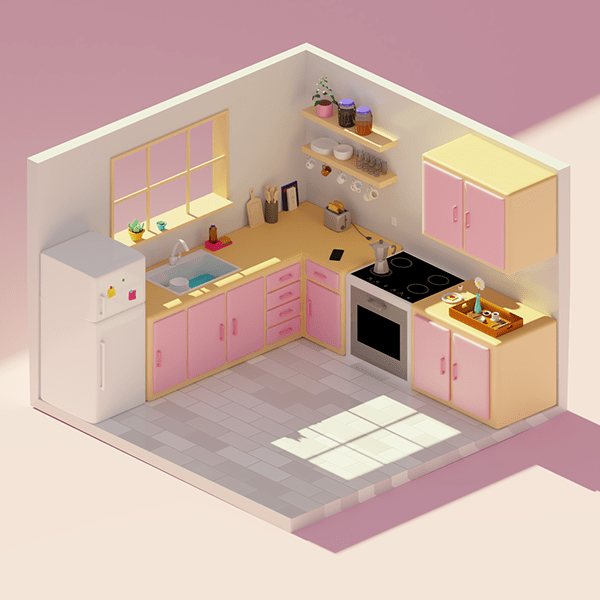
The height and width of the screenshot is (600, 600). Identify the location of pink handles on cabinets. (158, 353), (222, 335), (237, 330), (440, 363), (455, 373), (465, 218), (451, 211).